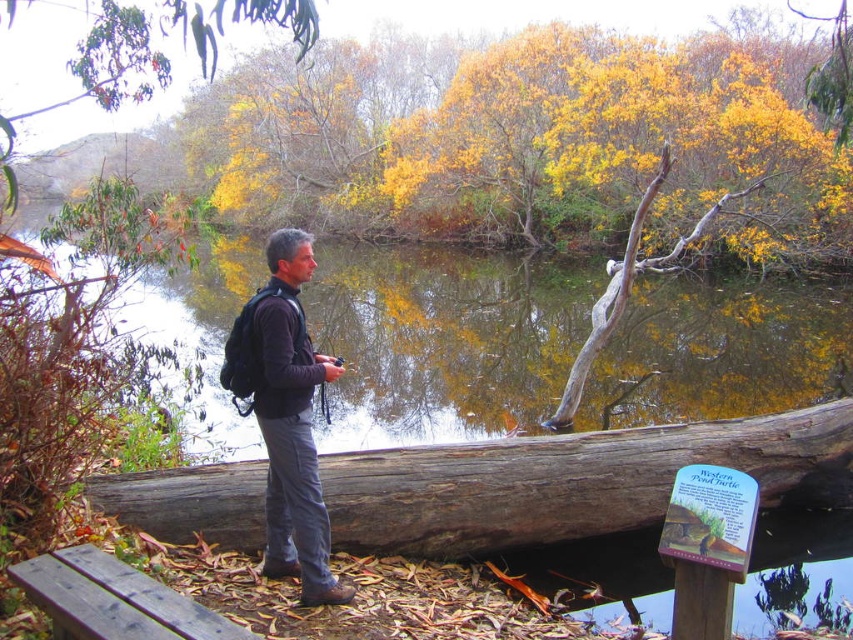
Which is behind, point (254, 170) or point (769, 387)?

The point (254, 170) is behind.

Where is `yellow leafy tree at center`? yellow leafy tree at center is located at coordinates (546, 145).

Who is higher up, greenish-brown water at center or dark gray fabric jacket at center?

Positioned higher is greenish-brown water at center.

Does greenish-brown water at center appear over dark gray fabric jacket at center?

Indeed, greenish-brown water at center is positioned over dark gray fabric jacket at center.

Which is behind, point (850, 310) or point (293, 269)?

Point (850, 310)

The width and height of the screenshot is (853, 640). Identify the location of greenish-brown water at center. (444, 340).

Can you confirm if yellow leafy tree at center is bigger than yellow-green foliage at upper left?

Yes.

Can you confirm if yellow leafy tree at center is positioned to the right of yellow-green foliage at upper left?

Indeed, yellow leafy tree at center is positioned on the right side of yellow-green foliage at upper left.

In the scene shown: Who is more distant from viewer, [375,168] or [13,132]?

Positioned behind is point [375,168].

In order to click on yellow leafy tree at center in this screenshot , I will do `click(546, 145)`.